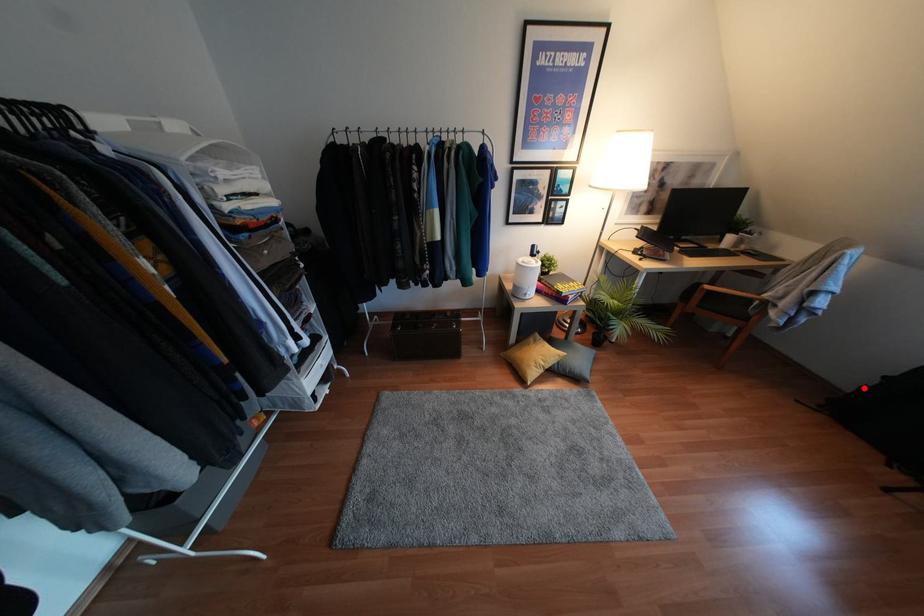
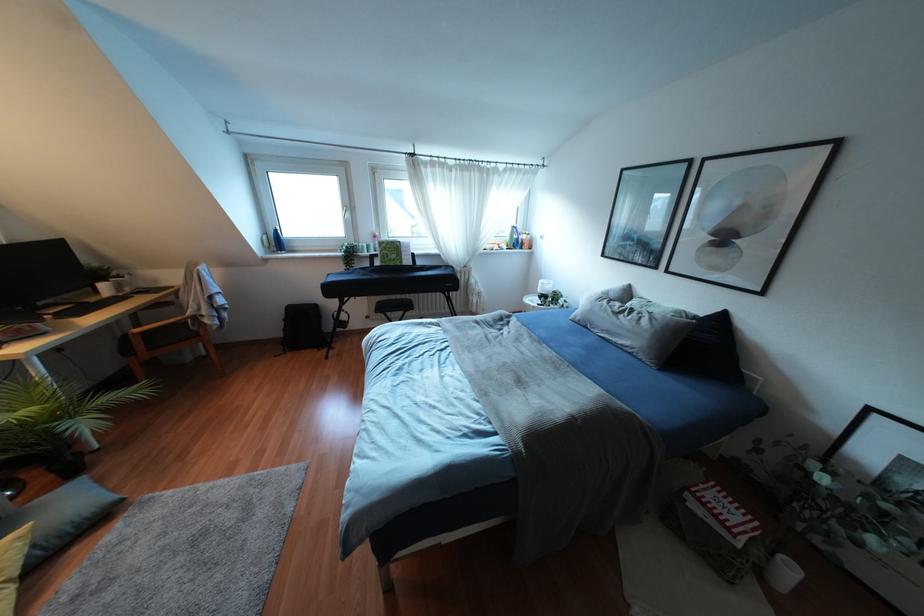
Question: I am providing you with two images of the same scene from different viewpoints. Given a red point in image1, look at the same physical point in image2. Is it:

Choices:
 (A) Closer to the viewpoint
 (B) Farther from the viewpoint

Answer: (A)